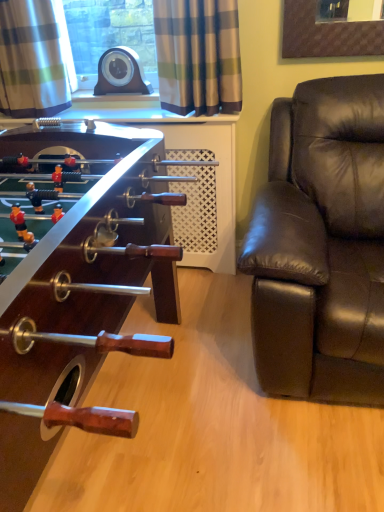
Question: Does plaid fabric curtain at upper left, the second curtain in the right-to-left sequence, contain brown leather couch at right?

Choices:
 (A) yes
 (B) no

Answer: (B)

Question: Are plaid fabric curtain at upper left, placed as the 1th curtain when sorted from left to right, and brown leather couch at right beside each other?

Choices:
 (A) no
 (B) yes

Answer: (A)

Question: Does plaid fabric curtain at upper left, the second curtain in the right-to-left sequence, appear on the left side of brown leather couch at right?

Choices:
 (A) yes
 (B) no

Answer: (A)

Question: Are plaid fabric curtain at upper left, the second curtain in the right-to-left sequence, and brown leather couch at right far apart?

Choices:
 (A) yes
 (B) no

Answer: (A)

Question: Is plaid fabric curtain at upper left, placed as the 1th curtain when sorted from left to right, positioned with its back to brown leather couch at right?

Choices:
 (A) no
 (B) yes

Answer: (A)

Question: Is plaid fabric curtain at upper left, the second curtain in the right-to-left sequence, outside of brown leather couch at right?

Choices:
 (A) no
 (B) yes

Answer: (B)

Question: Does plaid fabric curtain at upper center, the first curtain viewed from the right, turn towards plaid fabric curtain at upper left, placed as the 1th curtain when sorted from left to right?

Choices:
 (A) yes
 (B) no

Answer: (B)

Question: Is plaid fabric curtain at upper center, marked as the 2th curtain in a left-to-right arrangement, shorter than plaid fabric curtain at upper left, the second curtain in the right-to-left sequence?

Choices:
 (A) no
 (B) yes

Answer: (B)

Question: Considering the relative sizes of plaid fabric curtain at upper center, the first curtain viewed from the right, and plaid fabric curtain at upper left, the second curtain in the right-to-left sequence, in the image provided, is plaid fabric curtain at upper center, the first curtain viewed from the right, taller than plaid fabric curtain at upper left, the second curtain in the right-to-left sequence,?

Choices:
 (A) no
 (B) yes

Answer: (A)

Question: Is plaid fabric curtain at upper center, marked as the 2th curtain in a left-to-right arrangement, with plaid fabric curtain at upper left, the second curtain in the right-to-left sequence?

Choices:
 (A) yes
 (B) no

Answer: (B)

Question: Considering the relative sizes of plaid fabric curtain at upper center, the first curtain viewed from the right, and plaid fabric curtain at upper left, placed as the 1th curtain when sorted from left to right, in the image provided, is plaid fabric curtain at upper center, the first curtain viewed from the right, bigger than plaid fabric curtain at upper left, placed as the 1th curtain when sorted from left to right,?

Choices:
 (A) no
 (B) yes

Answer: (A)

Question: Is plaid fabric curtain at upper center, the first curtain viewed from the right, thinner than plaid fabric curtain at upper left, the second curtain in the right-to-left sequence?

Choices:
 (A) yes
 (B) no

Answer: (A)

Question: From the image's perspective, is plaid fabric curtain at upper left, placed as the 1th curtain when sorted from left to right, on plaid fabric curtain at upper center, marked as the 2th curtain in a left-to-right arrangement?

Choices:
 (A) no
 (B) yes

Answer: (B)